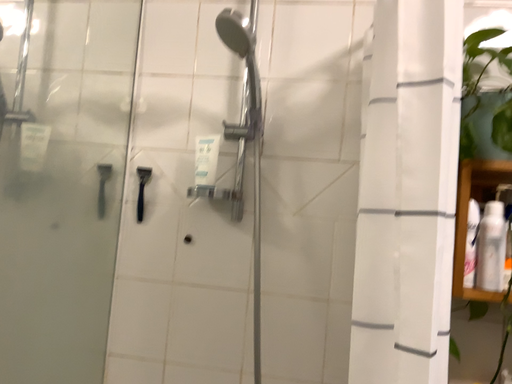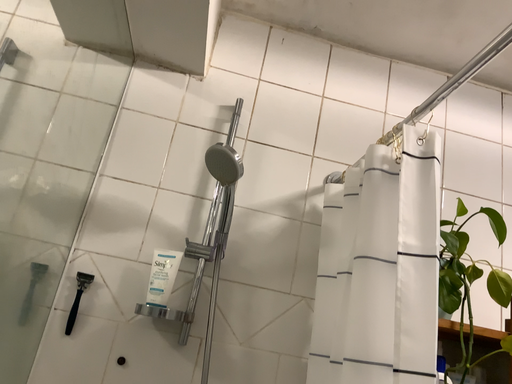
Question: Which way did the camera rotate in the video?

Choices:
 (A) rotated right
 (B) rotated left

Answer: (A)